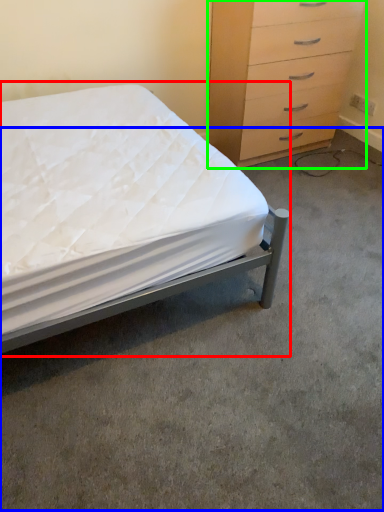
Question: Estimate the real-world distances between objects in this image. Which object is farther from bed (highlighted by a red box), concrete (highlighted by a blue box) or chest of drawers (highlighted by a green box)?

Choices:
 (A) concrete
 (B) chest of drawers

Answer: (B)